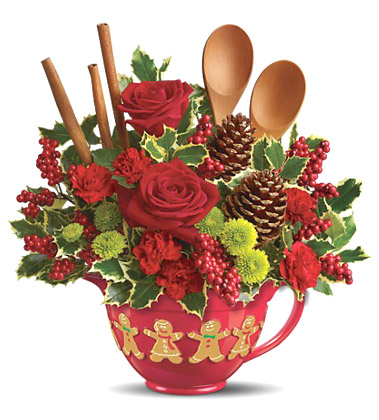
Locate an element on the screen. The height and width of the screenshot is (420, 379). vase is located at coordinates (192, 378).